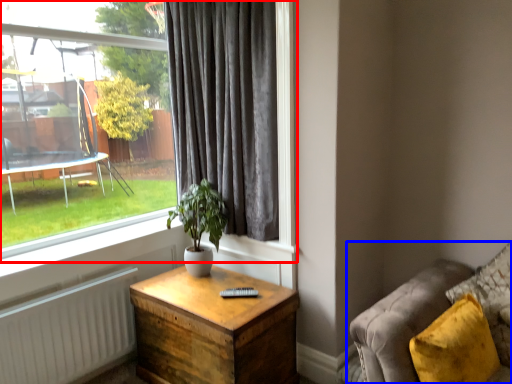
Question: Which point is closer to the camera, window (highlighted by a red box) or studio couch (highlighted by a blue box)?

Choices:
 (A) window
 (B) studio couch

Answer: (B)